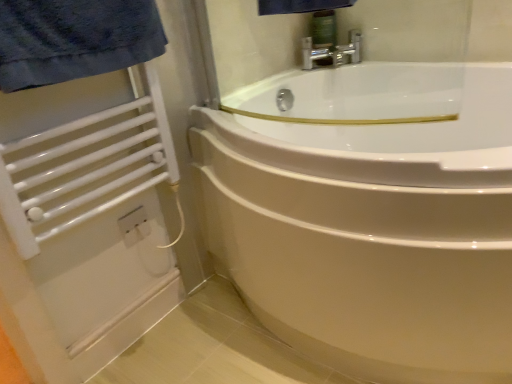
Question: Should I look upward or downward to see white glossy bathtub at center?

Choices:
 (A) down
 (B) up

Answer: (B)

Question: Is white glossy bathtub at center far away from white metal towel rack at left?

Choices:
 (A) yes
 (B) no

Answer: (B)

Question: From a real-world perspective, is white glossy bathtub at center positioned under white metal towel rack at left based on gravity?

Choices:
 (A) no
 (B) yes

Answer: (B)

Question: Does white glossy bathtub at center have a lesser width compared to white metal towel rack at left?

Choices:
 (A) yes
 (B) no

Answer: (B)

Question: Does white glossy bathtub at center have a greater width compared to white metal towel rack at left?

Choices:
 (A) yes
 (B) no

Answer: (A)

Question: Is white glossy bathtub at center behind white metal towel rack at left?

Choices:
 (A) yes
 (B) no

Answer: (B)

Question: From the image's perspective, is white glossy bathtub at center under white metal towel rack at left?

Choices:
 (A) no
 (B) yes

Answer: (B)

Question: Does white metal towel rack at left appear on the left side of white glossy bathtub at center?

Choices:
 (A) no
 (B) yes

Answer: (B)

Question: Considering the relative positions of white metal towel rack at left and white glossy bathtub at center in the image provided, is white metal towel rack at left to the right of white glossy bathtub at center from the viewer's perspective?

Choices:
 (A) yes
 (B) no

Answer: (B)

Question: Is white metal towel rack at left outside of white glossy bathtub at center?

Choices:
 (A) yes
 (B) no

Answer: (A)

Question: Is white metal towel rack at left thinner than white glossy bathtub at center?

Choices:
 (A) no
 (B) yes

Answer: (B)

Question: Could you tell me if white metal towel rack at left is turned towards white glossy bathtub at center?

Choices:
 (A) no
 (B) yes

Answer: (A)

Question: Does white metal towel rack at left have a greater height compared to white glossy bathtub at center?

Choices:
 (A) yes
 (B) no

Answer: (B)

Question: From a real-world perspective, is white glossy bathtub at center positioned above or below white metal towel rack at left?

Choices:
 (A) above
 (B) below

Answer: (B)